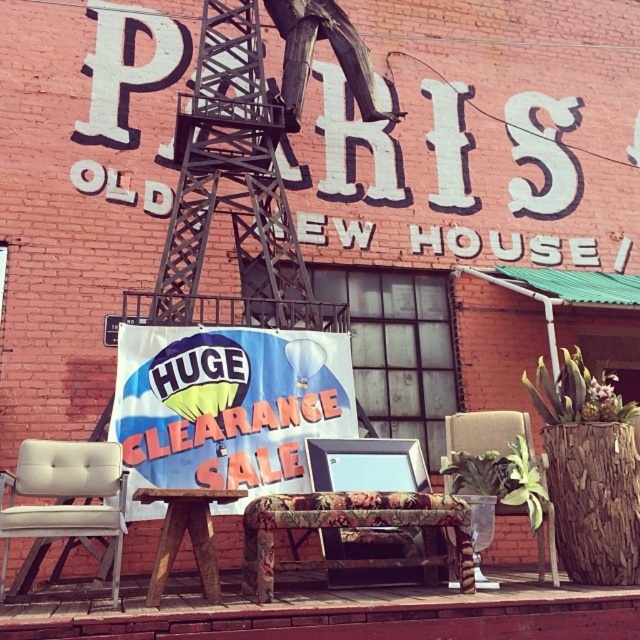
Is blue fabric sign at center bigger than wooden stool at center?

Correct, blue fabric sign at center is larger in size than wooden stool at center.

The image size is (640, 640). I want to click on blue fabric sign at center, so click(227, 406).

Is blue fabric sign at center thinner than wooden textured chair at center?

In fact, blue fabric sign at center might be wider than wooden textured chair at center.

Is blue fabric sign at center shorter than wooden textured chair at center?

Yes.

The height and width of the screenshot is (640, 640). Identify the location of blue fabric sign at center. (227, 406).

What do you see at coordinates (230, 186) in the screenshot?
I see `rusty metal crane at center` at bounding box center [230, 186].

Who is more distant from viewer, (218, 204) or (224, 493)?

Positioned behind is point (218, 204).

Based on the photo, who is more distant from viewer, (172, 205) or (154, 493)?

Point (172, 205)

The width and height of the screenshot is (640, 640). Find the location of `rusty metal crane at center`. rusty metal crane at center is located at coordinates (230, 186).